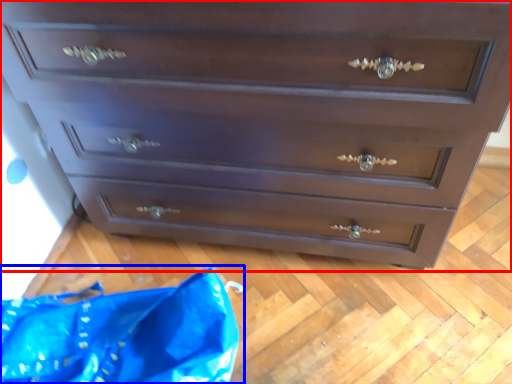
Question: Which object appears closest to the camera in this image, chest of drawers (highlighted by a red box) or material (highlighted by a blue box)?

Choices:
 (A) chest of drawers
 (B) material

Answer: (A)